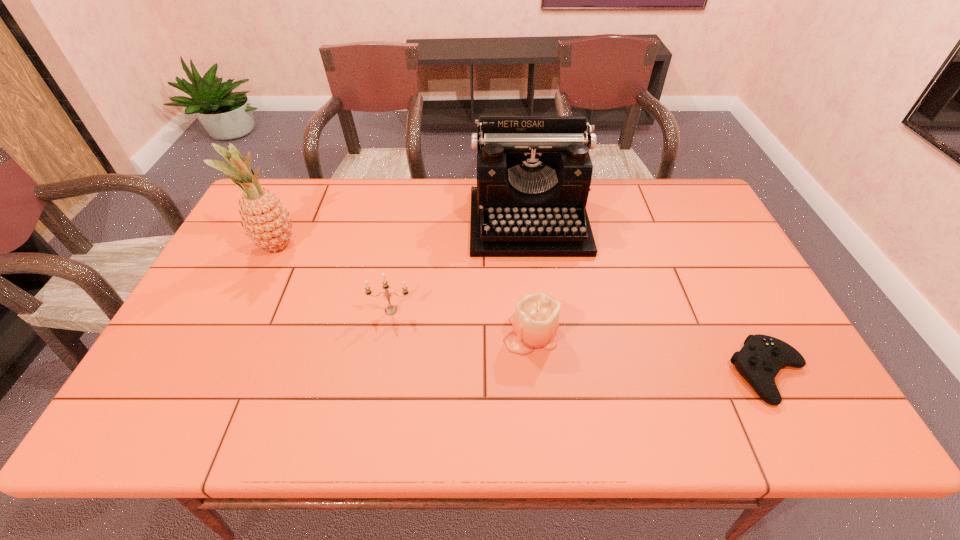
This screenshot has height=540, width=960. In order to click on vacant area that lies between the pineapple and the fourth shortest object in this screenshot , I will do `click(402, 234)`.

The height and width of the screenshot is (540, 960). Find the location of `free point between the typewriter and the pineapple`. free point between the typewriter and the pineapple is located at coordinates (402, 234).

The image size is (960, 540). I want to click on free area in between the typewriter and the fourth object from right to left, so click(x=460, y=266).

Image resolution: width=960 pixels, height=540 pixels. I want to click on vacant point located between the right candle and the rightmost object, so click(650, 353).

You are a GUI agent. You are given a task and a screenshot of the screen. Output one action in this format:
    pyautogui.click(x=<x>, y=<y>)
    Task: Click on the vacant space that is in between the left candle and the shortest object
    This screenshot has height=540, width=960.
    Given the screenshot: What is the action you would take?
    pyautogui.click(x=580, y=342)

Point out which object is positioned as the fourth nearest to the shortest object. Please provide its 2D coordinates. Your answer should be formatted as a tuple, i.e. [(x, y)], where the tuple contains the x and y coordinates of a point satisfying the conditions above.

[(266, 222)]

Select which object is the closest to the rightmost object. Please provide its 2D coordinates. Your answer should be formatted as a tuple, i.e. [(x, y)], where the tuple contains the x and y coordinates of a point satisfying the conditions above.

[(535, 321)]

Locate an element on the screen. The height and width of the screenshot is (540, 960). free spot that satisfies the following two spatial constraints: 1. on the typing side of the fourth shortest object; 2. on the left side of the control is located at coordinates (547, 373).

This screenshot has height=540, width=960. I want to click on vacant space that satisfies the following two spatial constraints: 1. on the typing side of the shortest object; 2. on the left side of the typewriter, so click(547, 373).

I want to click on vacant space that satisfies the following two spatial constraints: 1. on the front side of the right candle; 2. on the left side of the rightmost object, so click(536, 373).